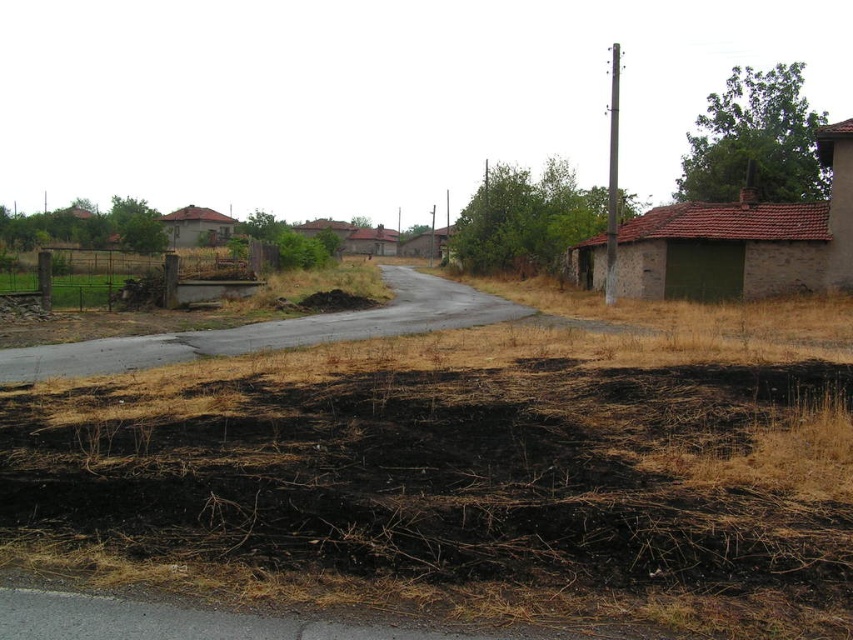
You are a firefighter assessing the scene after a wildfire. You see burnt dry grass at lower center and brown dry grass at left. Which area is more likely to be a recent fire site based on their positions?

The burnt dry grass at lower center is more likely to be a recent fire site because it is positioned below the brown dry grass at left, indicating it might be closer to the origin or more recently affected.

You are standing at the viewer position in the rural scene. There is a point marked at coordinates (306, 436). Can you reach that point within 10 seconds if you walk at a normal pace of 3 feet per second?

The distance between the viewer and the point is 22.83 feet. At a walking speed of 3 feet per second, it would take approximately 7.61 seconds to reach the point. Since this is under 10 seconds, yes, you can reach the point within the time limit.

Looking at this image, you are a hiker trying to cross the area with the burnt dry grass at lower center and the brown dry grass at left. Which grass area is shorter and safer to walk through?

The burnt dry grass at lower center has a lesser height compared to the brown dry grass at left, so it is shorter and safer to walk through.